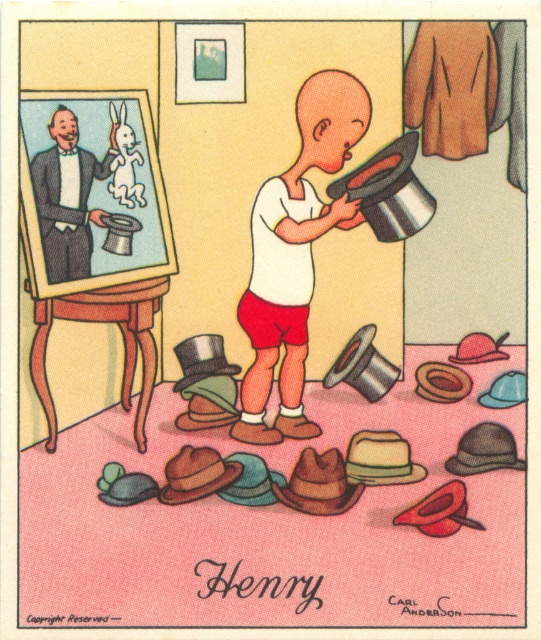
Who is more distant from viewer, (x=38, y=145) or (x=293, y=376)?

The point (x=293, y=376) is behind.

Which of these two, brushed wood easel at upper left or white matte shirt at center, stands shorter?

With less height is brushed wood easel at upper left.

Locate an element on the screen. This screenshot has height=640, width=541. brushed wood easel at upper left is located at coordinates (94, 228).

At what (x,y) coordinates should I click in order to perform the action: click on brushed wood easel at upper left. Please return your answer as a coordinate pair (x, y). Image resolution: width=541 pixels, height=640 pixels. Looking at the image, I should click on (94, 228).

Does point (63, 125) come in front of point (51, 166)?

Yes.

Identify the location of brushed wood easel at upper left. pos(94,228).

Does white matte shirt at center have a lesser height compared to smooth black suit at left?

Incorrect, white matte shirt at center's height does not fall short of smooth black suit at left's.

Between white matte shirt at center and smooth black suit at left, which one appears on the left side from the viewer's perspective?

From the viewer's perspective, smooth black suit at left appears more on the left side.

The image size is (541, 640). In order to click on white matte shirt at center in this screenshot , I will do `click(294, 253)`.